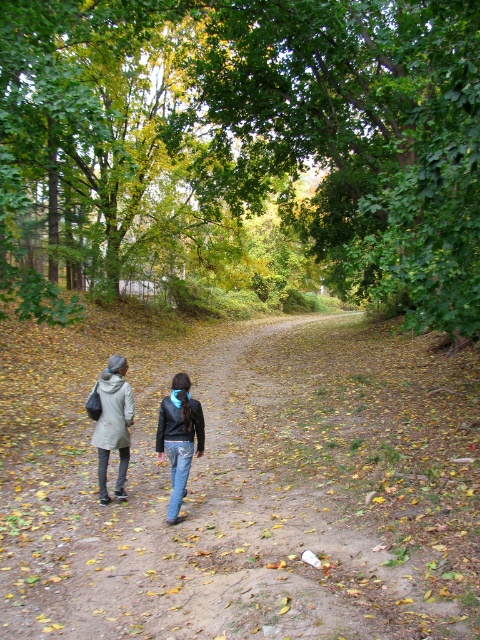
Is point (252, 104) positioned behind point (121, 385)?

Yes, it is behind point (121, 385).

In the scene shown: Which is above, green leafy tree at center or light gray coat at center?

green leafy tree at center is above.

Locate an element on the screen. The width and height of the screenshot is (480, 640). green leafy tree at center is located at coordinates (241, 150).

Is green leafy tree at center above gray wool coat at lower left?

Indeed, green leafy tree at center is positioned over gray wool coat at lower left.

Is green leafy tree at center closer to camera compared to gray wool coat at lower left?

Yes, green leafy tree at center is closer to the viewer.

Does point (3, 228) lie behind point (116, 384)?

That is True.

At what (x,y) coordinates should I click in order to perform the action: click on green leafy tree at center. Please return your answer as a coordinate pair (x, y). This screenshot has width=480, height=640. Looking at the image, I should click on (241, 150).

Does brown dirt path at center have a smaller size compared to light gray coat at center?

Actually, brown dirt path at center might be larger than light gray coat at center.

Does brown dirt path at center have a greater width compared to light gray coat at center?

Indeed, brown dirt path at center has a greater width compared to light gray coat at center.

Measure the distance between brown dirt path at center and camera.

They are 3.40 meters apart.

Find the location of `brown dirt path at center`. brown dirt path at center is located at coordinates (243, 483).